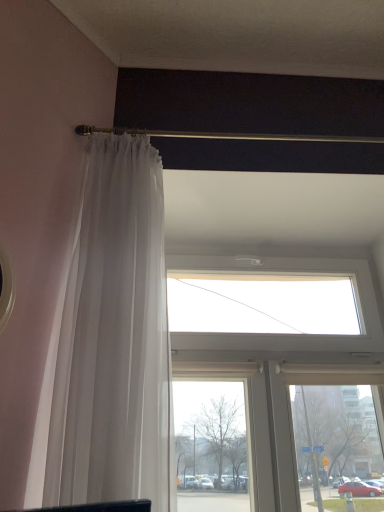
Question: Is transparent glass window at upper center not near gold metallic rod at upper center?

Choices:
 (A) yes
 (B) no

Answer: (B)

Question: Is transparent glass window at upper center to the left of gold metallic rod at upper center from the viewer's perspective?

Choices:
 (A) yes
 (B) no

Answer: (B)

Question: Can you confirm if transparent glass window at upper center is thinner than gold metallic rod at upper center?

Choices:
 (A) no
 (B) yes

Answer: (A)

Question: Does transparent glass window at upper center appear on the right side of gold metallic rod at upper center?

Choices:
 (A) yes
 (B) no

Answer: (A)

Question: Is transparent glass window at upper center directly adjacent to gold metallic rod at upper center?

Choices:
 (A) yes
 (B) no

Answer: (B)

Question: From a real-world perspective, is transparent glass window at upper center positioned over gold metallic rod at upper center based on gravity?

Choices:
 (A) no
 (B) yes

Answer: (A)

Question: Is sheer white curtain at left thinner than gold metallic rod at upper center?

Choices:
 (A) yes
 (B) no

Answer: (B)

Question: Considering the relative positions of sheer white curtain at left and gold metallic rod at upper center in the image provided, is sheer white curtain at left in front of gold metallic rod at upper center?

Choices:
 (A) yes
 (B) no

Answer: (A)

Question: Does sheer white curtain at left have a greater height compared to gold metallic rod at upper center?

Choices:
 (A) yes
 (B) no

Answer: (A)

Question: From a real-world perspective, is sheer white curtain at left positioned under gold metallic rod at upper center based on gravity?

Choices:
 (A) no
 (B) yes

Answer: (B)

Question: Would you consider sheer white curtain at left to be distant from gold metallic rod at upper center?

Choices:
 (A) yes
 (B) no

Answer: (B)

Question: Can you confirm if sheer white curtain at left is wider than gold metallic rod at upper center?

Choices:
 (A) yes
 (B) no

Answer: (A)

Question: Does gold metallic rod at upper center have a smaller size compared to sheer white curtain at left?

Choices:
 (A) yes
 (B) no

Answer: (A)